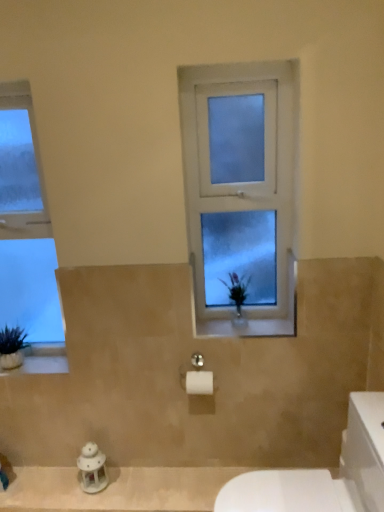
Question: Can you confirm if white glossy porcelain at lower right is bigger than clear glass window at left, the first window positioned from the left?

Choices:
 (A) no
 (B) yes

Answer: (B)

Question: Is white glossy porcelain at lower right facing away from clear glass window at left, the second window viewed from the right?

Choices:
 (A) yes
 (B) no

Answer: (B)

Question: Does white glossy porcelain at lower right lie behind clear glass window at left, the first window positioned from the left?

Choices:
 (A) yes
 (B) no

Answer: (B)

Question: Is white glossy porcelain at lower right closer to the viewer compared to clear glass window at left, the first window positioned from the left?

Choices:
 (A) yes
 (B) no

Answer: (A)

Question: Would you say white glossy porcelain at lower right contains clear glass window at left, the first window positioned from the left?

Choices:
 (A) yes
 (B) no

Answer: (B)

Question: Is point (362, 487) closer or farther from the camera than point (273, 230)?

Choices:
 (A) closer
 (B) farther

Answer: (A)

Question: Would you say white glossy porcelain at lower right is to the left or to the right of frosted glass window at center, positioned as the first window in right-to-left order, in the picture?

Choices:
 (A) right
 (B) left

Answer: (A)

Question: Is white glossy porcelain at lower right bigger or smaller than frosted glass window at center, the 2th window from the left?

Choices:
 (A) big
 (B) small

Answer: (A)

Question: Considering the positions of white glossy porcelain at lower right and frosted glass window at center, positioned as the first window in right-to-left order, in the image, is white glossy porcelain at lower right wider or thinner than frosted glass window at center, positioned as the first window in right-to-left order,?

Choices:
 (A) wide
 (B) thin

Answer: (A)

Question: In terms of height, does frosted glass window at center, positioned as the first window in right-to-left order, look taller or shorter compared to white glossy porcelain at lower right?

Choices:
 (A) short
 (B) tall

Answer: (B)

Question: Based on their sizes in the image, would you say frosted glass window at center, positioned as the first window in right-to-left order, is bigger or smaller than white glossy porcelain at lower right?

Choices:
 (A) big
 (B) small

Answer: (B)

Question: From a real-world perspective, is frosted glass window at center, the 2th window from the left, physically located above or below white glossy porcelain at lower right?

Choices:
 (A) below
 (B) above

Answer: (B)

Question: Do you think frosted glass window at center, the 2th window from the left, is within white glossy porcelain at lower right, or outside of it?

Choices:
 (A) inside
 (B) outside

Answer: (B)

Question: From the image's perspective, is white stone window sill at lower left positioned above or below white porcelain lantern at lower left?

Choices:
 (A) below
 (B) above

Answer: (B)

Question: Is point (4, 371) positioned closer to the camera than point (100, 475)?

Choices:
 (A) closer
 (B) farther

Answer: (A)